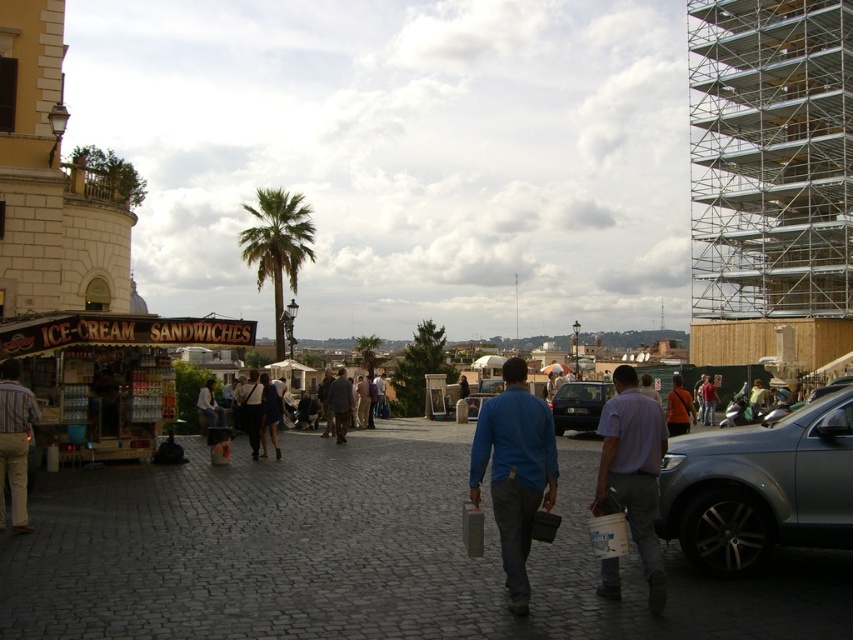
Is the position of green leafy palm tree at center more distant than that of blue cotton shirt at center?

Yes.

In the scene shown: Is green leafy palm tree at center bigger than blue cotton shirt at center?

Correct, green leafy palm tree at center is larger in size than blue cotton shirt at center.

Does point (370, 342) lie behind point (379, 378)?

Yes, it is behind point (379, 378).

Where is `green leafy palm tree at center`? The height and width of the screenshot is (640, 853). green leafy palm tree at center is located at coordinates (367, 352).

Does silver metallic car at right have a larger size compared to wooden ice cream stand at left?

Correct, silver metallic car at right is larger in size than wooden ice cream stand at left.

Is silver metallic car at right further to camera compared to wooden ice cream stand at left?

No, it is in front of wooden ice cream stand at left.

The image size is (853, 640). Find the location of `silver metallic car at right`. silver metallic car at right is located at coordinates (759, 488).

Is wooden ice cream stand at left thinner than dark blue shirt at center?

No.

Is wooden ice cream stand at left bigger than dark blue shirt at center?

Incorrect, wooden ice cream stand at left is not larger than dark blue shirt at center.

I want to click on wooden ice cream stand at left, so click(109, 372).